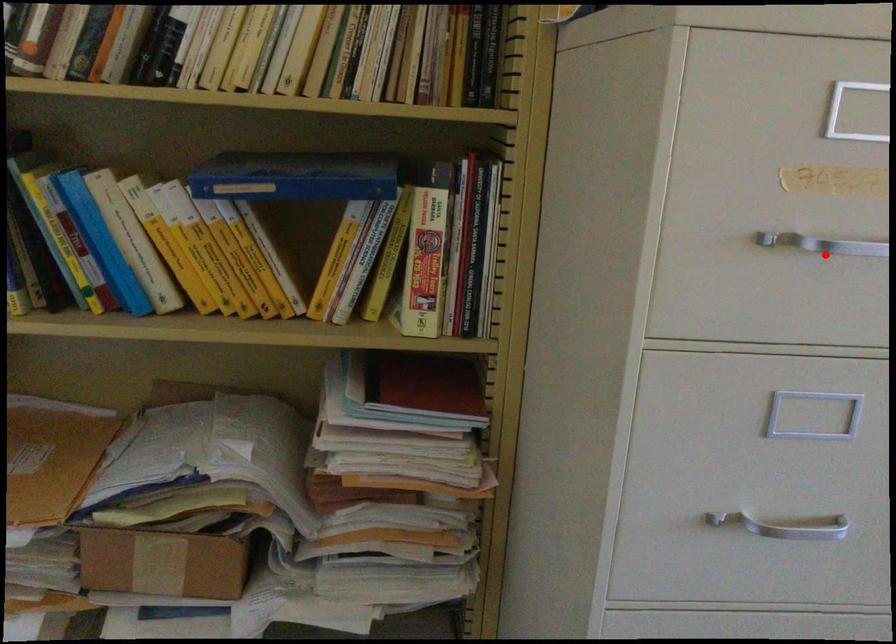
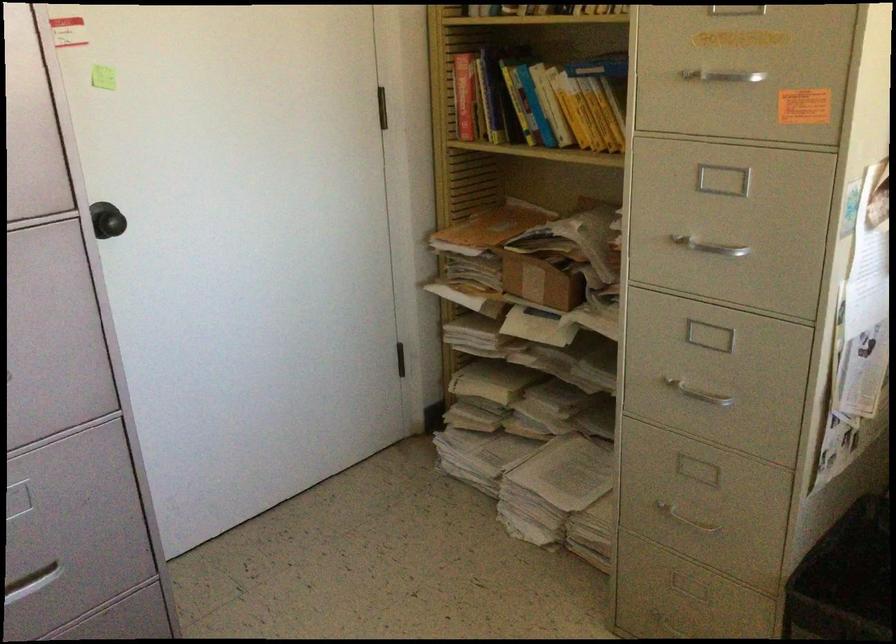
Question: I am providing you with two images of the same scene from different viewpoints. A red point is shown in image1. For the corresponding object point in image2, is it positioned nearer or farther from the camera?

Choices:
 (A) Nearer
 (B) Farther

Answer: (B)